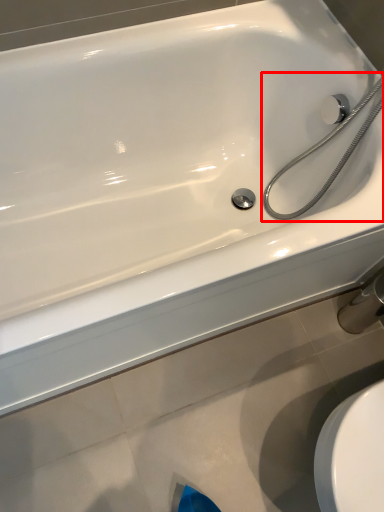
Question: From the image's perspective, where is shower (annotated by the red box) located relative to faucet?

Choices:
 (A) below
 (B) above

Answer: (B)